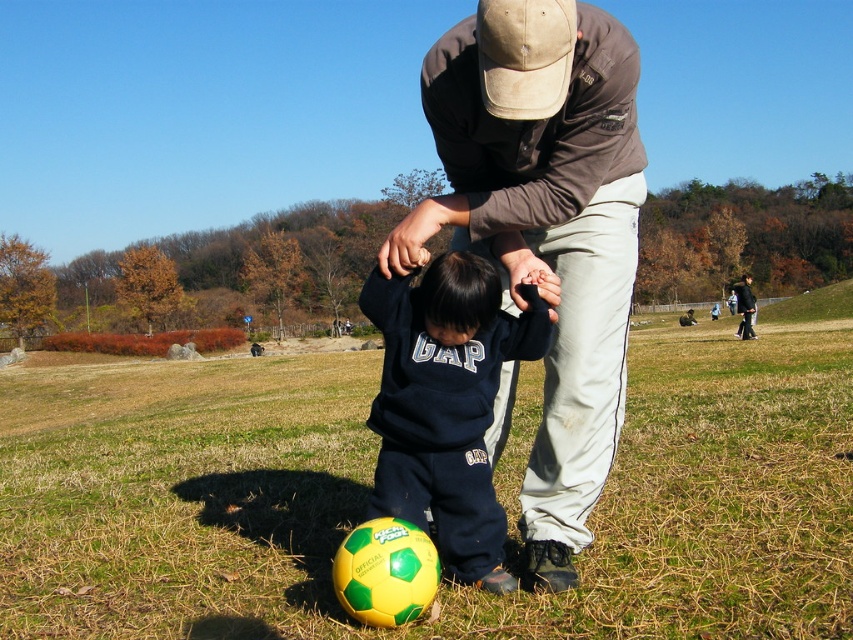
Does brown cotton shirt at center have a greater height compared to dark blue fleece at center?

Correct, brown cotton shirt at center is much taller as dark blue fleece at center.

Can you confirm if brown cotton shirt at center is bigger than dark blue fleece at center?

Indeed, brown cotton shirt at center has a larger size compared to dark blue fleece at center.

The height and width of the screenshot is (640, 853). Find the location of `brown cotton shirt at center`. brown cotton shirt at center is located at coordinates (544, 227).

The height and width of the screenshot is (640, 853). I want to click on brown cotton shirt at center, so click(x=544, y=227).

Is dark blue fleece at center thinner than dark blue sweater at lower center?

Yes.

Is dark blue fleece at center positioned at the back of dark blue sweater at lower center?

That is False.

The width and height of the screenshot is (853, 640). What do you see at coordinates (445, 404) in the screenshot?
I see `dark blue fleece at center` at bounding box center [445, 404].

Locate an element on the screen. The height and width of the screenshot is (640, 853). dark blue fleece at center is located at coordinates (445, 404).

Does brown cotton shirt at center have a lesser height compared to dark blue sweater at lower center?

Yes, brown cotton shirt at center is shorter than dark blue sweater at lower center.

Which is behind, point (601, 244) or point (746, 275)?

The point (746, 275) is more distant.

Does point (531, 243) lie in front of point (746, 332)?

Yes, it is.

Image resolution: width=853 pixels, height=640 pixels. Identify the location of brown cotton shirt at center. (544, 227).